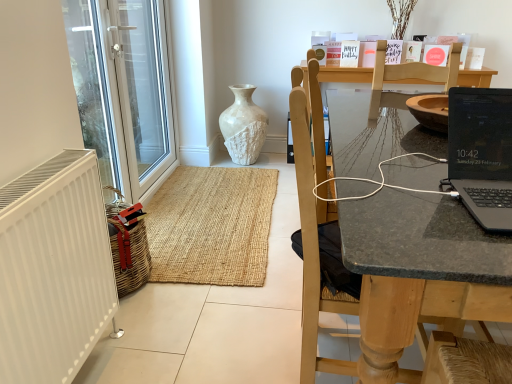
What is the approximate height of white matte radiator at left?

white matte radiator at left is 30.39 inches tall.

The height and width of the screenshot is (384, 512). Describe the element at coordinates (243, 126) in the screenshot. I see `white textured vase at center` at that location.

The image size is (512, 384). What do you see at coordinates (482, 154) in the screenshot?
I see `black glossy laptop at right` at bounding box center [482, 154].

Measure the distance between wooden chair at right and camera.

wooden chair at right and camera are 27.64 inches apart.

At what (x,y) coordinates should I click in order to perform the action: click on white matte radiator at left. Please return your answer as a coordinate pair (x, y). The height and width of the screenshot is (384, 512). Looking at the image, I should click on (53, 269).

Does white textured vase at center touch white matte radiator at left?

There is a gap between white textured vase at center and white matte radiator at left.

From a real-world perspective, is white textured vase at center physically above white matte radiator at left?

No, from a real-world perspective, white textured vase at center is not on top of white matte radiator at left.

Does point (234, 144) come in front of point (44, 262)?

That is False.

Who is smaller, white textured vase at center or white matte radiator at left?

Smaller between the two is white matte radiator at left.

Considering the points (78, 63) and (46, 240), which point is in front, point (78, 63) or point (46, 240)?

Point (46, 240)

Is transparent glass door at left aimed at white matte radiator at left?

No, transparent glass door at left is not facing towards white matte radiator at left.

From a real-world perspective, is transparent glass door at left positioned over white matte radiator at left based on gravity?

Correct, in the physical world, transparent glass door at left is higher than white matte radiator at left.

Considering the relative sizes of transparent glass door at left and white matte radiator at left in the image provided, is transparent glass door at left wider than white matte radiator at left?

In fact, transparent glass door at left might be narrower than white matte radiator at left.

Is black glossy laptop at right shorter than white textured vase at center?

Correct, black glossy laptop at right is not as tall as white textured vase at center.

Can you see black glossy laptop at right touching white textured vase at center?

No, black glossy laptop at right is not beside white textured vase at center.

Looking at this image, which object is positioned more to the left, black glossy laptop at right or white textured vase at center?

white textured vase at center is more to the left.

Is black glossy laptop at right bigger or smaller than white textured vase at center?

black glossy laptop at right is smaller than white textured vase at center.

From the picture: Is transparent glass door at left shorter than wooden chair at right?

In fact, transparent glass door at left may be taller than wooden chair at right.

Is transparent glass door at left far away from wooden chair at right?

transparent glass door at left is positioned a significant distance from wooden chair at right.

Do you think transparent glass door at left is within wooden chair at right, or outside of it?

transparent glass door at left cannot be found inside wooden chair at right.

In the scene shown: Is transparent glass door at left wider than wooden chair at right?

No.

From a real-world perspective, is black glossy laptop at right physically above transparent glass door at left?

Indeed, from a real-world perspective, black glossy laptop at right stands above transparent glass door at left.

Would you say black glossy laptop at right is outside transparent glass door at left?

Yes, black glossy laptop at right is located beyond the bounds of transparent glass door at left.

Between black glossy laptop at right and transparent glass door at left, which one has less height?

black glossy laptop at right is shorter.

Which is closer to the camera, (454, 99) or (157, 60)?

Positioned in front is point (454, 99).

Is wooden chair at right wider than black glossy laptop at right?

Yes.

Does wooden chair at right have a larger size compared to black glossy laptop at right?

Yes.

From the image's perspective, would you say wooden chair at right is shown under black glossy laptop at right?

Yes.

In the scene shown: Between white textured vase at center and wooden chair at right, which one is positioned behind?

white textured vase at center is further away from the camera.

Is white textured vase at center positioned beyond the bounds of wooden chair at right?

That's correct, white textured vase at center is outside of wooden chair at right.

From the image's perspective, is white textured vase at center below wooden chair at right?

No, from the image's perspective, white textured vase at center is not beneath wooden chair at right.

Where is `vase above the white matte radiator at left (from the image's perspective)`? vase above the white matte radiator at left (from the image's perspective) is located at coordinates pyautogui.click(x=243, y=126).

Locate an element on the screen. glass door lying on the left of white matte radiator at left is located at coordinates (123, 89).

From the image, which object appears to be farther from transparent glass door at left, white matte radiator at left or black glossy laptop at right?

Based on the image, black glossy laptop at right appears to be further to transparent glass door at left.

From the image, which object appears to be farther from transparent glass door at left, white textured vase at center or wooden chair at right?

wooden chair at right.

Which object lies nearer to the anchor point black glossy laptop at right, wooden chair at right or transparent glass door at left?

wooden chair at right is closer to black glossy laptop at right.

From the image, which object appears to be nearer to white textured vase at center, white matte radiator at left or transparent glass door at left?

Based on the image, transparent glass door at left appears to be nearer to white textured vase at center.

From the image, which object appears to be farther from white matte radiator at left, wooden chair at right or transparent glass door at left?

The object further to white matte radiator at left is transparent glass door at left.

Looking at the image, which one is located further to black glossy laptop at right, white textured vase at center or wooden chair at right?

white textured vase at center is further to black glossy laptop at right.

Looking at the image, which one is located further to white textured vase at center, transparent glass door at left or wooden chair at right?

Based on the image, wooden chair at right appears to be further to white textured vase at center.

Based on their spatial positions, is white textured vase at center or black glossy laptop at right closer to white matte radiator at left?

Among the two, black glossy laptop at right is located nearer to white matte radiator at left.

You are a GUI agent. You are given a task and a screenshot of the screen. Output one action in this format:
    pyautogui.click(x=<x>, y=<y>)
    Task: Click on the chair located between black glossy laptop at right and white textured vase at center in the depth direction
    
    Given the screenshot: What is the action you would take?
    pyautogui.click(x=396, y=269)

This screenshot has width=512, height=384. Find the location of `glass door between wooden chair at right and white textured vase at center in the front-back direction`. glass door between wooden chair at right and white textured vase at center in the front-back direction is located at coordinates (123, 89).

This screenshot has width=512, height=384. I want to click on radiator between transparent glass door at left and wooden chair at right from left to right, so click(53, 269).

At what (x,y) coordinates should I click in order to perform the action: click on chair located between transparent glass door at left and black glossy laptop at right in the left-right direction. Please return your answer as a coordinate pair (x, y). The width and height of the screenshot is (512, 384). Looking at the image, I should click on (396, 269).